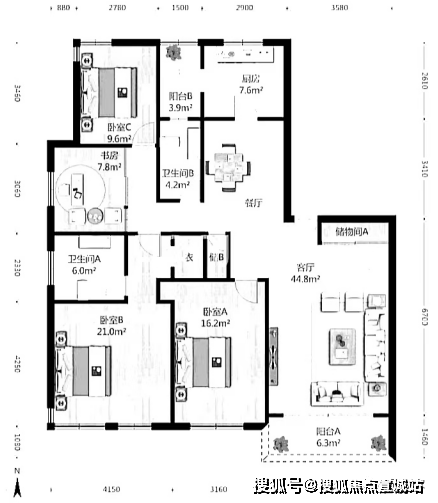
I want to click on floorplan, so click(x=191, y=248).